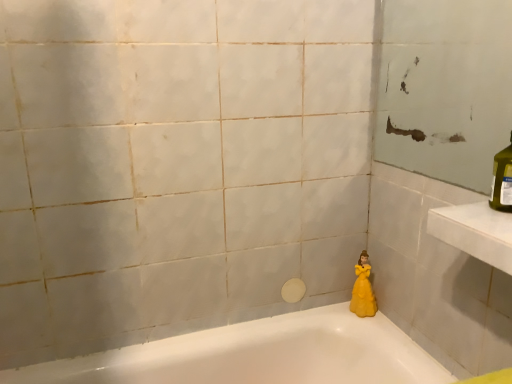
Question: From a real-world perspective, is white glossy bathtub at lower right physically below yellow matte doll at lower right?

Choices:
 (A) yes
 (B) no

Answer: (A)

Question: Is white glossy bathtub at lower right beside yellow matte doll at lower right?

Choices:
 (A) no
 (B) yes

Answer: (A)

Question: Is white glossy bathtub at lower right aimed at yellow matte doll at lower right?

Choices:
 (A) no
 (B) yes

Answer: (A)

Question: From the image's perspective, is white glossy bathtub at lower right beneath yellow matte doll at lower right?

Choices:
 (A) yes
 (B) no

Answer: (A)

Question: Is white glossy bathtub at lower right bigger than yellow matte doll at lower right?

Choices:
 (A) no
 (B) yes

Answer: (B)

Question: Is white glossy bathtub at lower right facing away from yellow matte doll at lower right?

Choices:
 (A) no
 (B) yes

Answer: (A)

Question: Is yellow matte doll at lower right bigger than white glossy bathtub at lower right?

Choices:
 (A) yes
 (B) no

Answer: (B)

Question: Does yellow matte doll at lower right have a greater height compared to white glossy bathtub at lower right?

Choices:
 (A) yes
 (B) no

Answer: (B)

Question: Does yellow matte doll at lower right come in front of white glossy bathtub at lower right?

Choices:
 (A) yes
 (B) no

Answer: (B)

Question: From a real-world perspective, is yellow matte doll at lower right positioned under white glossy bathtub at lower right based on gravity?

Choices:
 (A) no
 (B) yes

Answer: (A)

Question: From the image's perspective, is yellow matte doll at lower right above white glossy bathtub at lower right?

Choices:
 (A) no
 (B) yes

Answer: (B)

Question: Is yellow matte doll at lower right turned away from white glossy bathtub at lower right?

Choices:
 (A) yes
 (B) no

Answer: (B)

Question: Would you say yellow matte doll at lower right is inside or outside white glossy bathtub at lower right?

Choices:
 (A) outside
 (B) inside

Answer: (A)